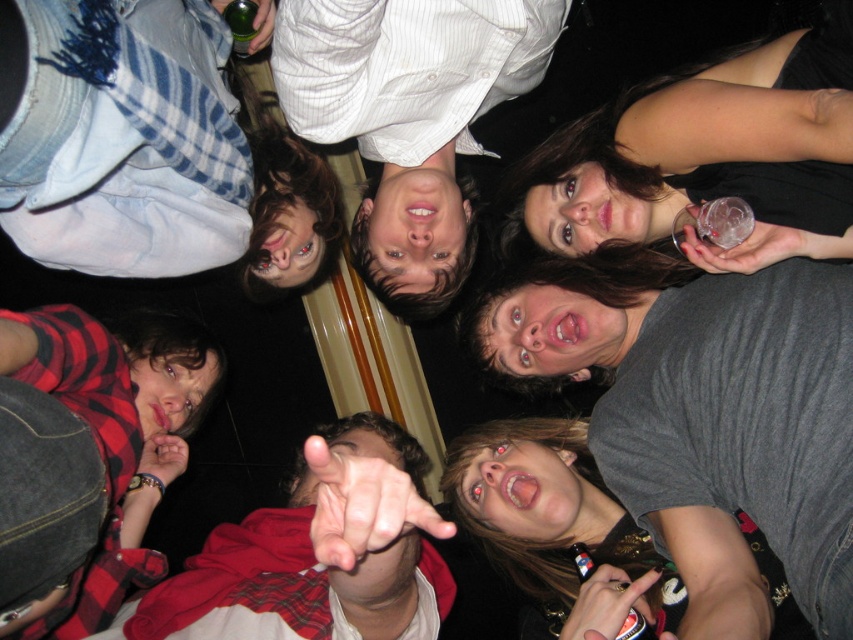
You are standing in the room and want to take a photo of the denim jacket at upper left and the plaid shirt at center. Which object should you focus on first if you want to capture both in one shot without moving the camera?

You should focus on the plaid shirt at center first because the denim jacket at upper left is to the left of it, so by centering the plaid shirt, the denim jacket will naturally be included in the frame.